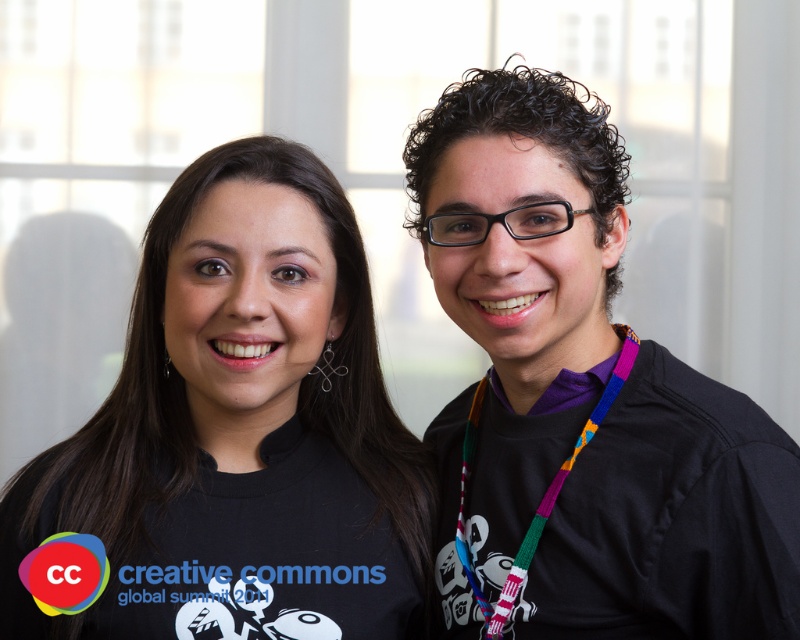
Question: Is the position of multicolored woven lanyard at center more distant than that of purple fabric at center?

Choices:
 (A) no
 (B) yes

Answer: (A)

Question: Is black matte shirt at left positioned before black fabric shirt at right?

Choices:
 (A) yes
 (B) no

Answer: (B)

Question: Which point is farther from the camera taking this photo?

Choices:
 (A) (588, 378)
 (B) (210, 428)

Answer: (B)

Question: Which point appears farthest from the camera in this image?

Choices:
 (A) (248, 385)
 (B) (466, 435)

Answer: (B)

Question: Which of the following is the farthest from the observer?

Choices:
 (A) matte black neck at center
 (B) purple fabric at center
 (C) black fabric shirt at right
 (D) multicolored woven lanyard at center

Answer: (B)

Question: Does matte black neck at center appear over multicolored woven lanyard at center?

Choices:
 (A) yes
 (B) no

Answer: (A)